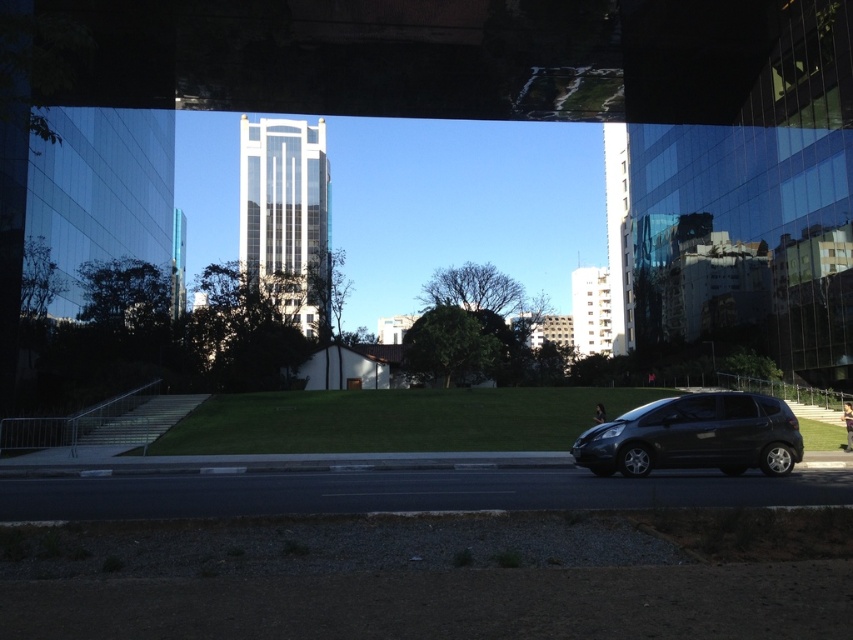
Question: Is clear glass tower at center bigger than shiny black hatchback at center?

Choices:
 (A) yes
 (B) no

Answer: (A)

Question: Is clear glass tower at center to the left of shiny black hatchback at center from the viewer's perspective?

Choices:
 (A) yes
 (B) no

Answer: (A)

Question: Does clear glass tower at center have a lesser width compared to shiny black hatchback at center?

Choices:
 (A) no
 (B) yes

Answer: (A)

Question: Among these objects, which one is farthest from the camera?

Choices:
 (A) clear glass tower at center
 (B) shiny black hatchback at center

Answer: (A)

Question: Which object is farther from the camera taking this photo?

Choices:
 (A) clear glass tower at center
 (B) shiny black hatchback at center

Answer: (A)

Question: Which of the following is the closest to the observer?

Choices:
 (A) clear glass tower at center
 (B) shiny black hatchback at center

Answer: (B)